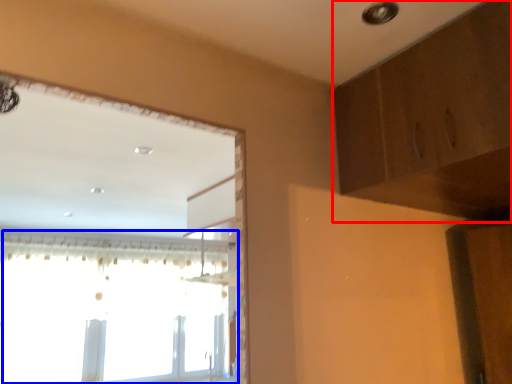
Question: Which point is further to the camera, dresser (highlighted by a red box) or window (highlighted by a blue box)?

Choices:
 (A) dresser
 (B) window

Answer: (B)